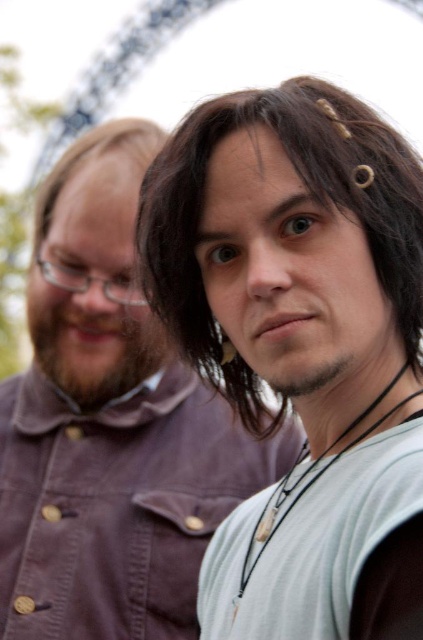
Question: Is matte brown shirt at center positioned in front of light gray fabric at center?

Choices:
 (A) yes
 (B) no

Answer: (B)

Question: Does matte brown shirt at center have a larger size compared to dark brown hair at center?

Choices:
 (A) no
 (B) yes

Answer: (B)

Question: Which object appears farthest from the camera in this image?

Choices:
 (A) light gray fabric at center
 (B) matte brown shirt at center
 (C) brown matte hair at upper left

Answer: (C)

Question: Which object appears farthest from the camera in this image?

Choices:
 (A) matte brown shirt at center
 (B) light gray fabric at center
 (C) dark brown hair at center

Answer: (A)

Question: Considering the relative positions of matte brown shirt at center and light gray fabric at center in the image provided, where is matte brown shirt at center located with respect to light gray fabric at center?

Choices:
 (A) left
 (B) right

Answer: (A)

Question: Which point is farther from the camera taking this photo?

Choices:
 (A) (126, 625)
 (B) (280, 90)

Answer: (A)